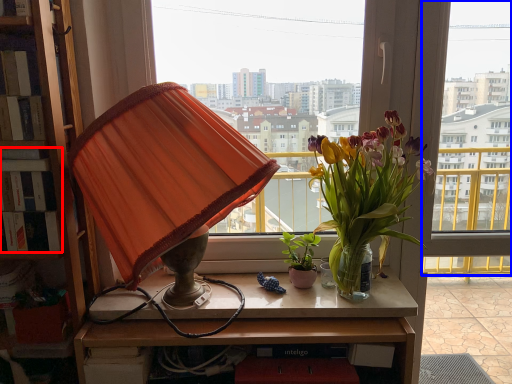
Question: Which point is further to the camera, book (highlighted by a red box) or window (highlighted by a blue box)?

Choices:
 (A) book
 (B) window

Answer: (B)